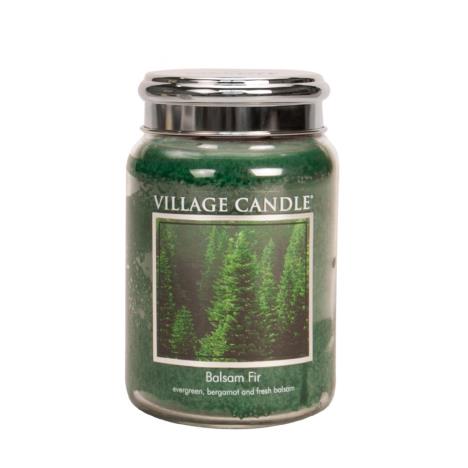
The width and height of the screenshot is (468, 468). Find the location of `glass jar`. glass jar is located at coordinates (141, 193).